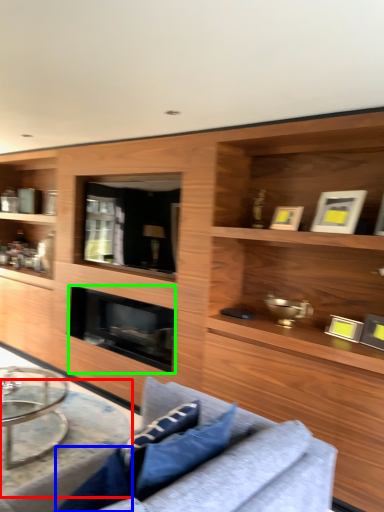
Question: Estimate the real-world distances between objects in this image. Which object is farther from round table (highlighted by a red box), pillow (highlighted by a blue box) or fireplace (highlighted by a green box)?

Choices:
 (A) pillow
 (B) fireplace

Answer: (A)